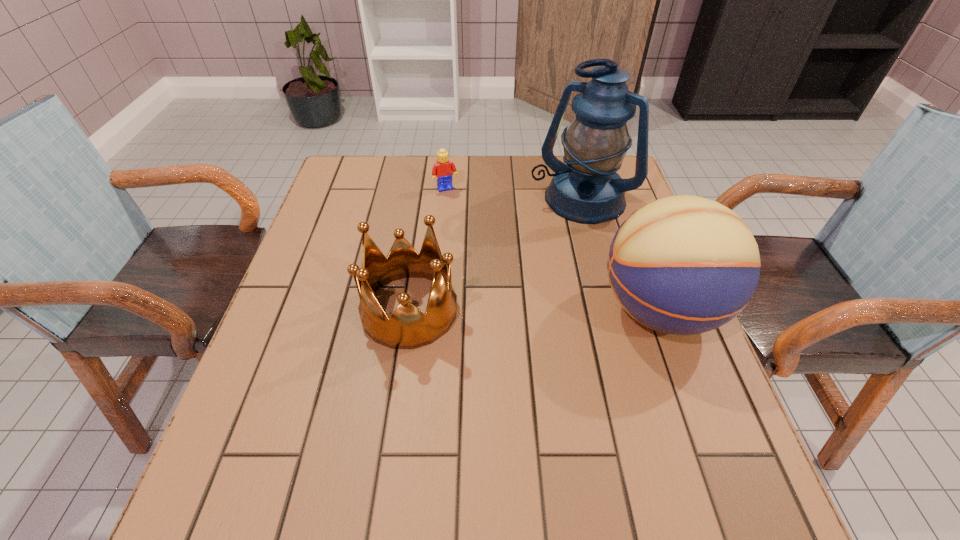
At what (x,y) coordinates should I click in order to perform the action: click on crown. Please return your answer as a coordinate pair (x, y). The width and height of the screenshot is (960, 540). Looking at the image, I should click on (408, 327).

Where is `the second tallest object`? The image size is (960, 540). the second tallest object is located at coordinates (684, 265).

What are the coordinates of `lantern` in the screenshot? It's located at (587, 190).

Locate an element on the screen. The image size is (960, 540). the shortest object is located at coordinates (443, 169).

Find the location of a particular element. This screenshot has height=540, width=960. free space located 0.210m on the back of the third tallest object is located at coordinates (422, 220).

You are a GUI agent. You are given a task and a screenshot of the screen. Output one action in this format:
    pyautogui.click(x=<x>, y=<y>)
    Task: Click on the free space located 0.060m on the patterned surface of the basketball
    The height and width of the screenshot is (540, 960).
    Given the screenshot: What is the action you would take?
    pyautogui.click(x=569, y=310)

Find the location of a particular element. free spot located on the patterned surface of the basketball is located at coordinates (488, 310).

The width and height of the screenshot is (960, 540). In order to click on blank space located 0.230m on the patterned surface of the basketball in this screenshot , I will do `click(492, 310)`.

At what (x,y) coordinates should I click in order to perform the action: click on free region located on the face of the lantern. Please return your answer as a coordinate pair (x, y). Image resolution: width=960 pixels, height=540 pixels. Looking at the image, I should click on (487, 324).

Where is `free region located 0.390m on the face of the lantern`? This screenshot has height=540, width=960. free region located 0.390m on the face of the lantern is located at coordinates (489, 321).